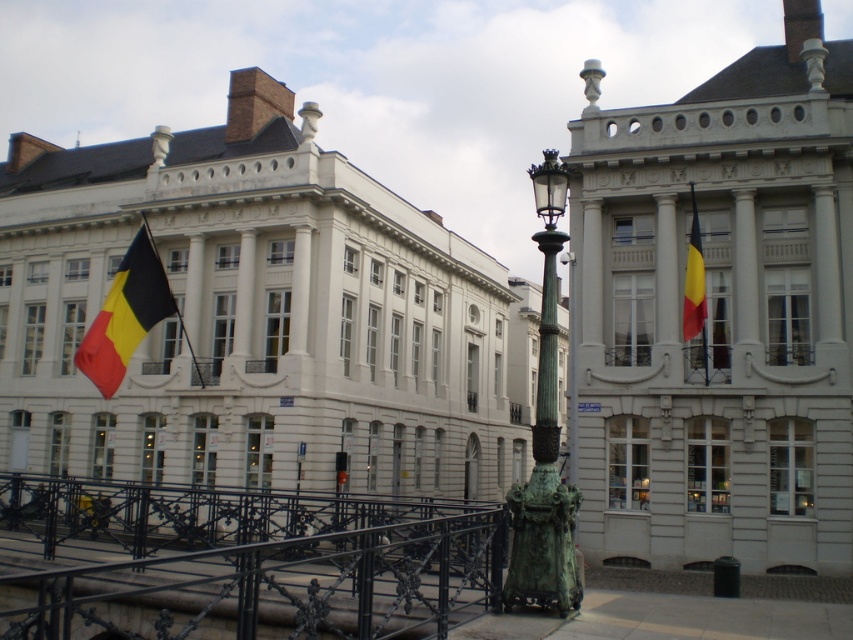
You are standing in the middle of the street looking at the matte white building at center and the polished metal flag pole at center. Which object is closer to your right side?

The matte white building at center is to the right of the polished metal flag pole at center, so it is closer to your right side.

You are a city planner reviewing this urban design. You need to determine if the matte white building at center and the polished metal flag pole at center are aligned along the same vertical axis. Based on the scene, can you confirm this?

The matte white building at center is positioned over the polished metal flag pole at center, so they are aligned along the same vertical axis.